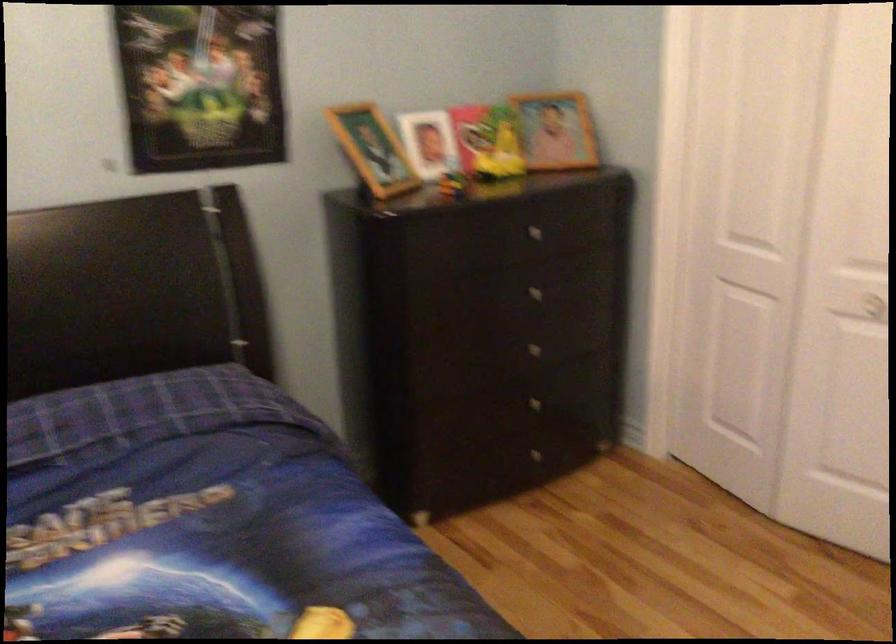
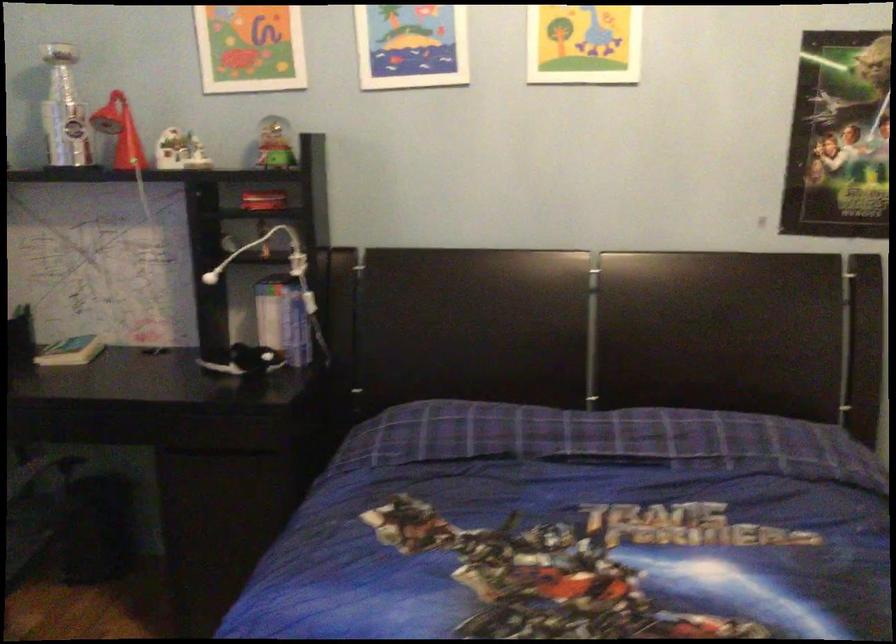
Question: The camera is either moving clockwise (left) or counter-clockwise (right) around the object. The first image is from the beginning of the video and the second image is from the end. Is the camera moving left or right when shooting the video?

Choices:
 (A) Left
 (B) Right

Answer: (B)